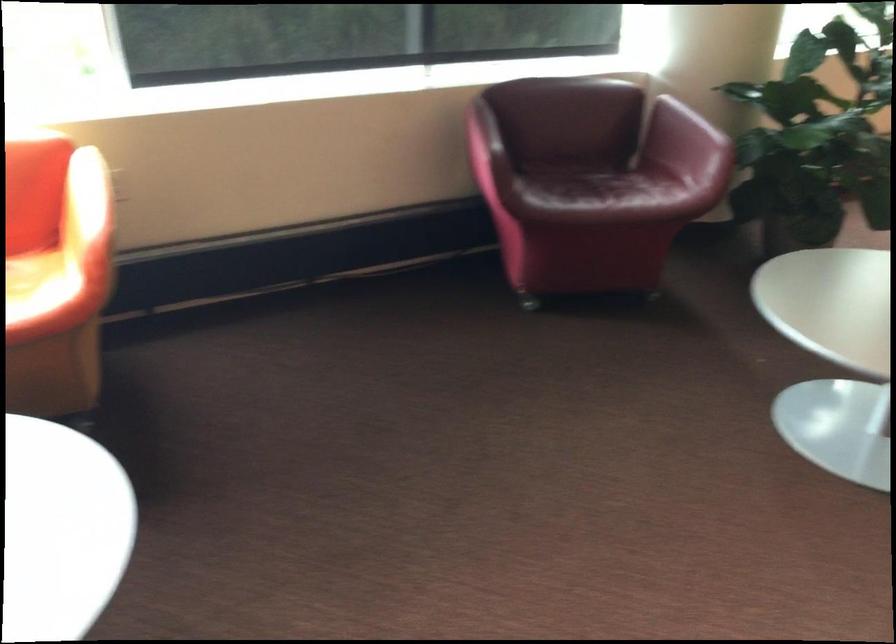
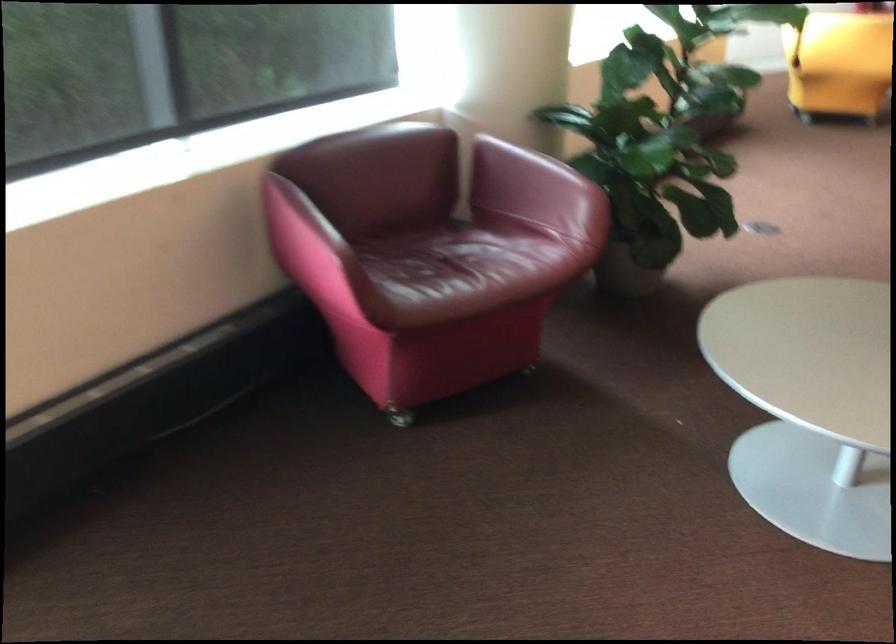
Find the pixel in the second image that matches point (592, 146) in the first image.

(426, 212)